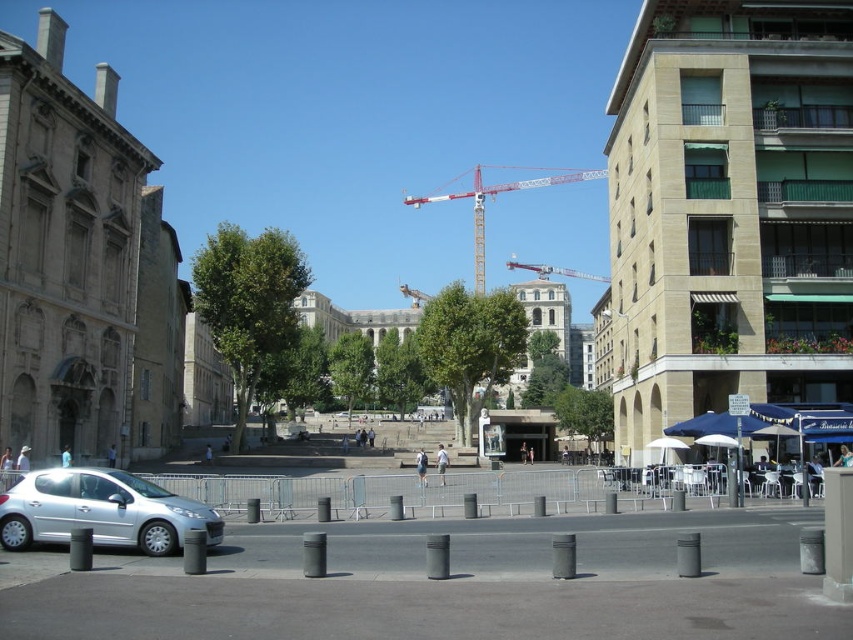
Which is above, metallic red crane at center or metallic construction crane at center?

metallic red crane at center is above.

Is metallic red crane at center smaller than metallic construction crane at center?

Incorrect, metallic red crane at center is not smaller in size than metallic construction crane at center.

At what (x,y) coordinates should I click in order to perform the action: click on metallic red crane at center. Please return your answer as a coordinate pair (x, y). Looking at the image, I should click on (553, 269).

Identify the location of metallic red crane at center. This screenshot has height=640, width=853. (553, 269).

Does silver metallic car at lower left appear under metallic red crane at center?

Correct, silver metallic car at lower left is located below metallic red crane at center.

Which is more to the left, silver metallic car at lower left or metallic red crane at center?

silver metallic car at lower left is more to the left.

Between point (20, 538) and point (543, 269), which one is positioned in front?

Point (20, 538)

In order to click on silver metallic car at lower left in this screenshot , I will do click(x=102, y=512).

Between white metal crane at center and metallic red crane at center, which one has less height?

Standing shorter between the two is metallic red crane at center.

Can you confirm if white metal crane at center is wider than metallic red crane at center?

Yes, white metal crane at center is wider than metallic red crane at center.

Is point (454, 196) less distant than point (595, 276)?

That is False.

This screenshot has width=853, height=640. Find the location of `white metal crane at center`. white metal crane at center is located at coordinates (492, 195).